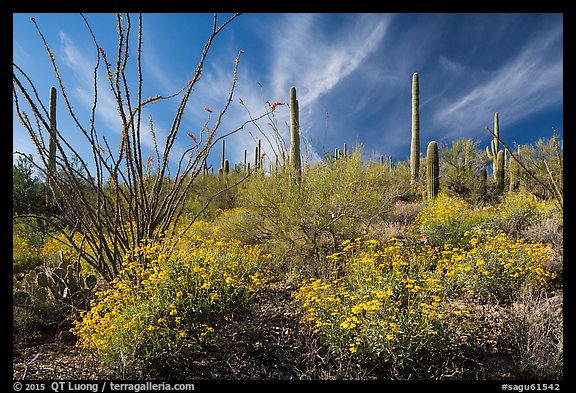
At what (x,y) coordinates should I click in order to perform the action: click on smaller cactus. Please return your answer as a coordinate pair (x, y). Looking at the image, I should click on (67, 282).